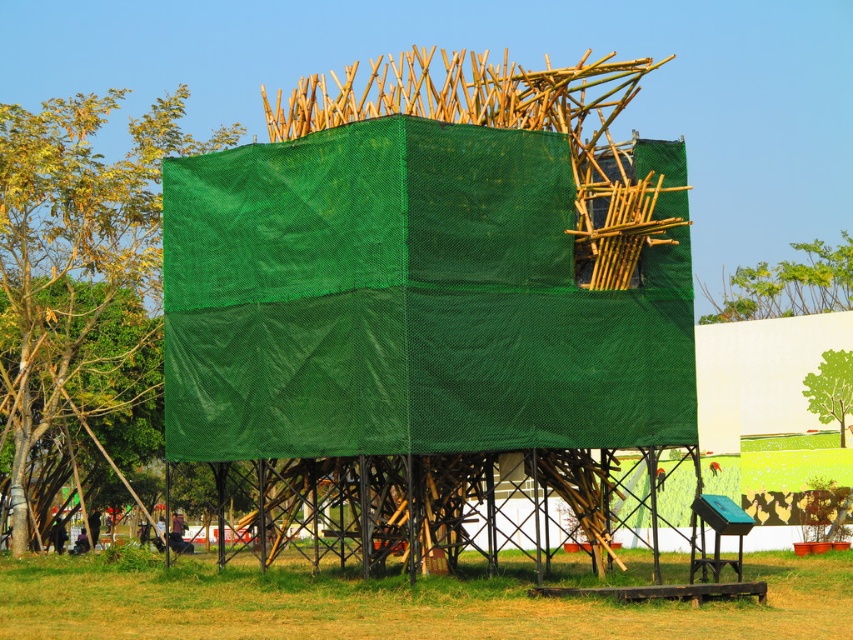
You are standing at the center of the cube structure covered in green tarp. Looking towards the green mesh tree at upper left located at point (79, 266), which direction should you face to see it?

To see the green mesh tree at upper left located at point (79, 266), you should face the upper left direction.

You are standing in front of the cube structure and want to determine the relative positions of two points marked on it. Which point is closer to you, point (x=815, y=291) or point (x=851, y=349)?

Point (x=815, y=291) is further to the viewer than point (x=851, y=349), so point (x=851, y=349) is closer to you.

What are the coordinates of the green mesh tree at upper left in the image?

The green mesh tree at upper left is located at coordinates (79, 266).